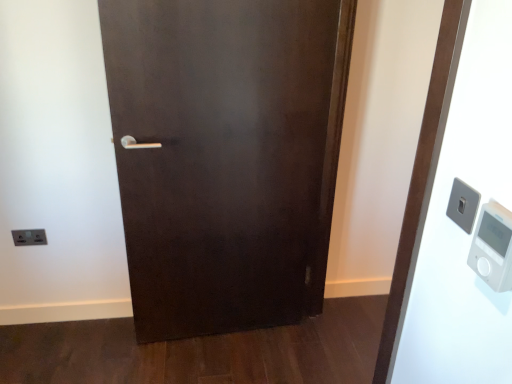
What do you see at coordinates (493, 247) in the screenshot? The height and width of the screenshot is (384, 512). I see `white plastic thermometer at right` at bounding box center [493, 247].

You are a GUI agent. You are given a task and a screenshot of the screen. Output one action in this format:
    pyautogui.click(x=<x>, y=<y>)
    Task: Click on the white plastic thermometer at right
    
    Given the screenshot: What is the action you would take?
    pyautogui.click(x=493, y=247)

At what (x,y) coordinates should I click in order to perform the action: click on white plastic elevator at right. Please return your answer as a coordinate pair (x, y). Image resolution: width=512 pixels, height=384 pixels. Looking at the image, I should click on (454, 222).

Identify the location of satin silver switch at lower left, the 2th light switch from the right. This screenshot has height=384, width=512. (29, 237).

In order to face satin silver switch at upper right, the first light switch from the right, should I rotate leftwards or rightwards?

Turn right by 25.502 degrees to look at satin silver switch at upper right, the first light switch from the right.

Identify the location of white plastic thermometer at right. The image size is (512, 384). (493, 247).

Based on the photo, can we say satin silver switch at upper right, the first light switch from the right, lies outside satin silver switch at lower left, the second light switch when ordered from top to bottom?

That's correct, satin silver switch at upper right, the first light switch from the right, is outside of satin silver switch at lower left, the second light switch when ordered from top to bottom.

Is satin silver switch at upper right, acting as the 1th light switch starting from the front, looking in the opposite direction of satin silver switch at lower left, the 2th light switch viewed from the front?

No, satin silver switch at lower left, the 2th light switch viewed from the front, is not at the back of satin silver switch at upper right, acting as the 1th light switch starting from the front.

Is point (460, 199) in front of point (45, 244)?

Yes, it is in front of point (45, 244).

Does satin silver switch at upper right, positioned as the 2th light switch in bottom-to-top order, come behind satin silver switch at lower left, the second light switch when ordered from top to bottom?

No, satin silver switch at upper right, positioned as the 2th light switch in bottom-to-top order, is closer to the camera.

Is white plastic elevator at right outside of satin silver switch at lower left, the 2th light switch from the right?

Yes.

From the image's perspective, between white plastic elevator at right and satin silver switch at lower left, the second light switch when ordered from top to bottom, which one is located above?

From the image's view, white plastic elevator at right is above.

What's the angular difference between white plastic elevator at right and satin silver switch at lower left, which ranks as the first light switch in bottom-to-top order,'s facing directions?

91.7 degrees.

Considering the relative sizes of white plastic elevator at right and satin silver switch at lower left, the 2th light switch from the right, in the image provided, is white plastic elevator at right shorter than satin silver switch at lower left, the 2th light switch from the right,?

No, white plastic elevator at right is not shorter than satin silver switch at lower left, the 2th light switch from the right.

From the picture: Is white plastic thermometer at right oriented away from white plastic elevator at right?

No, white plastic thermometer at right is not facing the opposite direction of white plastic elevator at right.

From a real-world perspective, relative to white plastic elevator at right, is white plastic thermometer at right vertically above or below?

In terms of real-world spatial position, white plastic thermometer at right is above white plastic elevator at right.

I want to click on thermometer in front of the white plastic elevator at right, so click(x=493, y=247).

Based on the photo, does satin silver switch at lower left, positioned as the first light switch in back-to-front order, have a smaller size compared to satin silver switch at upper right, the first light switch from the right?

No, satin silver switch at lower left, positioned as the first light switch in back-to-front order, is not smaller than satin silver switch at upper right, the first light switch from the right.

From the image's perspective, is satin silver switch at lower left, the 2th light switch viewed from the front, located above or below satin silver switch at upper right, the 2th light switch from the left?

From the image's perspective, satin silver switch at lower left, the 2th light switch viewed from the front, appears below satin silver switch at upper right, the 2th light switch from the left.

In the scene shown: Would you say satin silver switch at lower left, the second light switch when ordered from top to bottom, is to the left or to the right of satin silver switch at upper right, positioned as the 2th light switch in bottom-to-top order, in the picture?

Clearly, satin silver switch at lower left, the second light switch when ordered from top to bottom, is on the left of satin silver switch at upper right, positioned as the 2th light switch in bottom-to-top order, in the image.

Could you tell me if satin silver switch at lower left, marked as the 1th light switch in a left-to-right arrangement, is turned towards satin silver switch at upper right, acting as the 1th light switch starting from the front?

No, satin silver switch at lower left, marked as the 1th light switch in a left-to-right arrangement, does not turn towards satin silver switch at upper right, acting as the 1th light switch starting from the front.

From the image's perspective, which one is positioned lower, white plastic elevator at right or white plastic thermometer at right?

white plastic elevator at right appears lower in the image.

How different are the orientations of white plastic elevator at right and white plastic thermometer at right in degrees?

There is a 2.36-degree angle between the facing directions of white plastic elevator at right and white plastic thermometer at right.

Considering the relative sizes of white plastic elevator at right and white plastic thermometer at right in the image provided, is white plastic elevator at right bigger than white plastic thermometer at right?

Indeed, white plastic elevator at right has a larger size compared to white plastic thermometer at right.

Which object is wider, white plastic elevator at right or white plastic thermometer at right?

With larger width is white plastic elevator at right.

Looking at this image, measure the distance from white plastic thermometer at right to satin silver switch at lower left, which ranks as the first light switch in bottom-to-top order.

A distance of 1.88 meters exists between white plastic thermometer at right and satin silver switch at lower left, which ranks as the first light switch in bottom-to-top order.

Identify the location of light switch that is the 2nd object to the left of the white plastic thermometer at right, starting at the anchor. This screenshot has width=512, height=384. (29, 237).

Does point (496, 213) come in front of point (31, 235)?

Yes, point (496, 213) is closer to viewer.

Is white plastic thermometer at right bigger or smaller than satin silver switch at lower left, positioned as the first light switch in back-to-front order?

Considering their sizes, white plastic thermometer at right takes up more space than satin silver switch at lower left, positioned as the first light switch in back-to-front order.

From a real-world perspective, is satin silver switch at upper right, which is the 1th light switch from top to bottom, above or below white plastic elevator at right?

In terms of real-world spatial position, satin silver switch at upper right, which is the 1th light switch from top to bottom, is above white plastic elevator at right.

Is satin silver switch at upper right, the 2th light switch from the left, oriented away from white plastic elevator at right?

No, satin silver switch at upper right, the 2th light switch from the left,'s orientation is not away from white plastic elevator at right.

Between satin silver switch at upper right, the 2th light switch from the left, and white plastic elevator at right, which one has smaller size?

Smaller between the two is satin silver switch at upper right, the 2th light switch from the left.

Where is `light switch in front of the satin silver switch at lower left, the 2th light switch from the right`? The height and width of the screenshot is (384, 512). light switch in front of the satin silver switch at lower left, the 2th light switch from the right is located at coordinates (463, 205).

In the image, there is a white plastic elevator at right. Where is `light switch below it (from the image's perspective)`? The height and width of the screenshot is (384, 512). light switch below it (from the image's perspective) is located at coordinates (29, 237).

Estimate the real-world distances between objects in this image. Which object is further from satin silver switch at lower left, which ranks as the first light switch in bottom-to-top order, white plastic elevator at right or white plastic thermometer at right?

white plastic thermometer at right is further to satin silver switch at lower left, which ranks as the first light switch in bottom-to-top order.

Considering their positions, is white plastic thermometer at right positioned further to white plastic elevator at right than satin silver switch at lower left, positioned as the first light switch in back-to-front order?

satin silver switch at lower left, positioned as the first light switch in back-to-front order, is positioned further to the anchor white plastic elevator at right.

Consider the image. Looking at the image, which one is located closer to satin silver switch at lower left, marked as the 1th light switch in a left-to-right arrangement, white plastic thermometer at right or satin silver switch at upper right, the 2th light switch from the left?

The object closer to satin silver switch at lower left, marked as the 1th light switch in a left-to-right arrangement, is satin silver switch at upper right, the 2th light switch from the left.

Considering their positions, is white plastic thermometer at right positioned closer to white plastic elevator at right than satin silver switch at upper right, which is the 1th light switch from top to bottom?

satin silver switch at upper right, which is the 1th light switch from top to bottom, is closer to white plastic elevator at right.

From the image, which object appears to be farther from satin silver switch at lower left, the 2th light switch viewed from the front, satin silver switch at upper right, the second light switch viewed from the back, or white plastic thermometer at right?

white plastic thermometer at right.

From the image, which object appears to be nearer to white plastic elevator at right, satin silver switch at upper right, the first light switch from the right, or white plastic thermometer at right?

The object closer to white plastic elevator at right is satin silver switch at upper right, the first light switch from the right.

Estimate the real-world distances between objects in this image. Which object is closer to white plastic elevator at right, satin silver switch at upper right, acting as the 1th light switch starting from the front, or satin silver switch at lower left, the second light switch when ordered from top to bottom?

satin silver switch at upper right, acting as the 1th light switch starting from the front.

From the image, which object appears to be farther from white plastic thermometer at right, white plastic elevator at right or satin silver switch at upper right, positioned as the 2th light switch in bottom-to-top order?

white plastic elevator at right is positioned further to the anchor white plastic thermometer at right.

At what (x,y) coordinates should I click in order to perform the action: click on elevator located between white plastic thermometer at right and satin silver switch at upper right, acting as the 1th light switch starting from the front, in the depth direction. Please return your answer as a coordinate pair (x, y). Looking at the image, I should click on (454, 222).

You are a GUI agent. You are given a task and a screenshot of the screen. Output one action in this format:
    pyautogui.click(x=<x>, y=<y>)
    Task: Click on the light switch between satin silver switch at lower left, the 2th light switch viewed from the front, and white plastic thermometer at right from left to right
    The image size is (512, 384).
    Given the screenshot: What is the action you would take?
    click(463, 205)

Locate an element on the screen. Image resolution: width=512 pixels, height=384 pixels. elevator situated between satin silver switch at lower left, which ranks as the first light switch in bottom-to-top order, and white plastic thermometer at right from left to right is located at coordinates (454, 222).

Locate an element on the screen. The height and width of the screenshot is (384, 512). elevator between satin silver switch at lower left, marked as the 1th light switch in a left-to-right arrangement, and satin silver switch at upper right, acting as the 1th light switch starting from the front, in the horizontal direction is located at coordinates (454, 222).